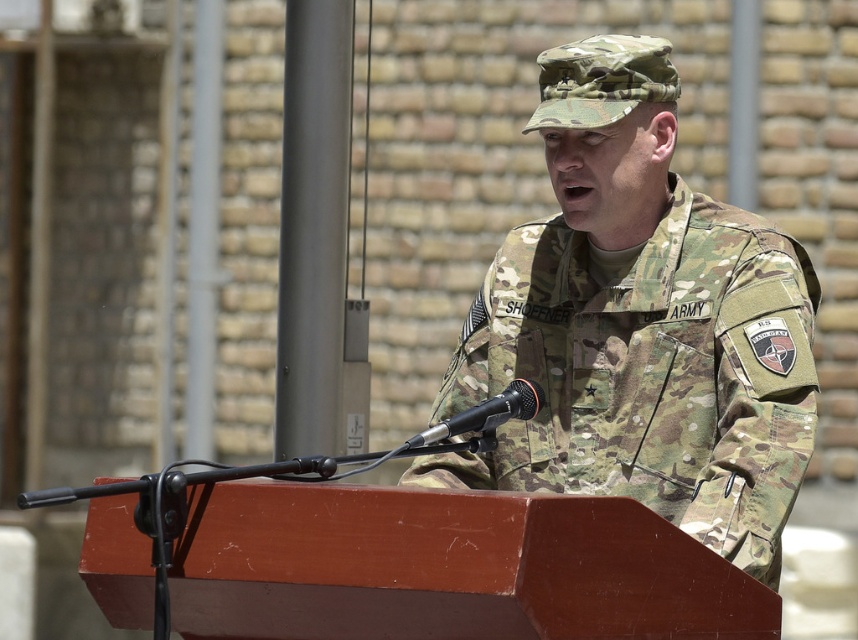
Question: Among these objects, which one is nearest to the camera?

Choices:
 (A) black matte microphone at center
 (B) camo uniform at center

Answer: (A)

Question: Considering the relative positions of camo uniform at center and black matte microphone at center in the image provided, where is camo uniform at center located with respect to black matte microphone at center?

Choices:
 (A) right
 (B) left

Answer: (A)

Question: Is camo uniform at center positioned in front of black matte microphone at center?

Choices:
 (A) no
 (B) yes

Answer: (A)

Question: Is camo uniform at center to the right of black matte microphone at center from the viewer's perspective?

Choices:
 (A) yes
 (B) no

Answer: (A)

Question: Which object is closer to the camera taking this photo?

Choices:
 (A) camo uniform at center
 (B) black matte microphone at center

Answer: (B)

Question: Which object appears farthest from the camera in this image?

Choices:
 (A) black matte microphone at center
 (B) camo uniform at center

Answer: (B)